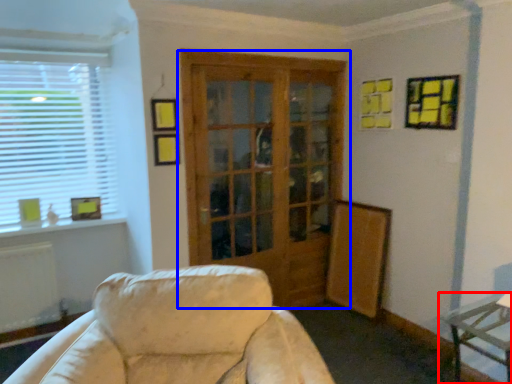
Question: Which object appears farthest to the camera in this image, table (highlighted by a red box) or door (highlighted by a blue box)?

Choices:
 (A) table
 (B) door

Answer: (B)